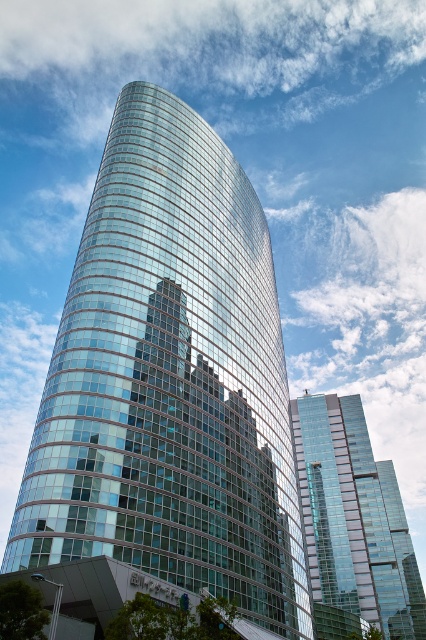
Question: Which object appears closest to the camera in this image?

Choices:
 (A) transparent glass skyscraper at center
 (B) transparent glass tower at center

Answer: (B)

Question: Which point is closer to the camera?

Choices:
 (A) transparent glass skyscraper at center
 (B) transparent glass tower at center

Answer: (B)

Question: Which of the following is the closest to the observer?

Choices:
 (A) transparent glass tower at center
 (B) transparent glass skyscraper at center

Answer: (A)

Question: Where is transparent glass tower at center located in relation to transparent glass skyscraper at center in the image?

Choices:
 (A) below
 (B) above

Answer: (B)

Question: Does transparent glass tower at center have a greater width compared to transparent glass skyscraper at center?

Choices:
 (A) no
 (B) yes

Answer: (A)

Question: Is transparent glass tower at center above transparent glass skyscraper at center?

Choices:
 (A) yes
 (B) no

Answer: (A)